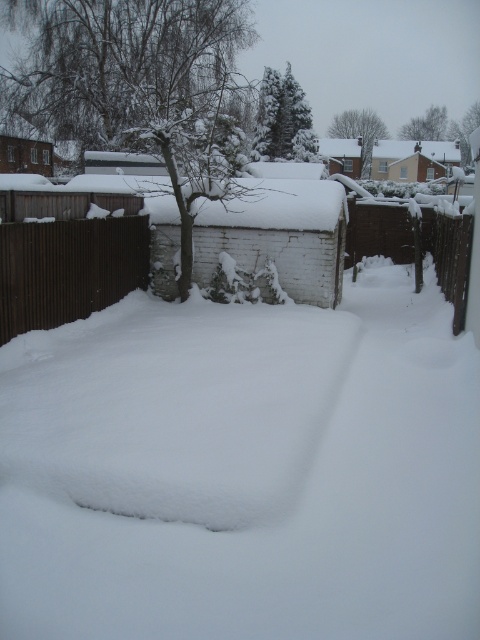
Question: Estimate the real-world distances between objects in this image. Which object is closer to the brown wooden fence at right?

Choices:
 (A) brick house at upper left
 (B) brown wooden fence at left

Answer: (B)

Question: Is brown wooden fence at left behind white brick house at upper center?

Choices:
 (A) no
 (B) yes

Answer: (A)

Question: Which of the following is the closest to the observer?

Choices:
 (A) (20, 156)
 (B) (412, 259)

Answer: (B)

Question: Which of the following is the farthest from the observer?

Choices:
 (A) brown wooden fence at right
 (B) white brick house at upper center
 (C) brick house at upper left
 (D) brown wooden fence at left

Answer: (B)

Question: Is brown wooden fence at left wider than brown wooden fence at right?

Choices:
 (A) yes
 (B) no

Answer: (B)

Question: Does brown wooden fence at left appear over brick house at upper left?

Choices:
 (A) yes
 (B) no

Answer: (B)